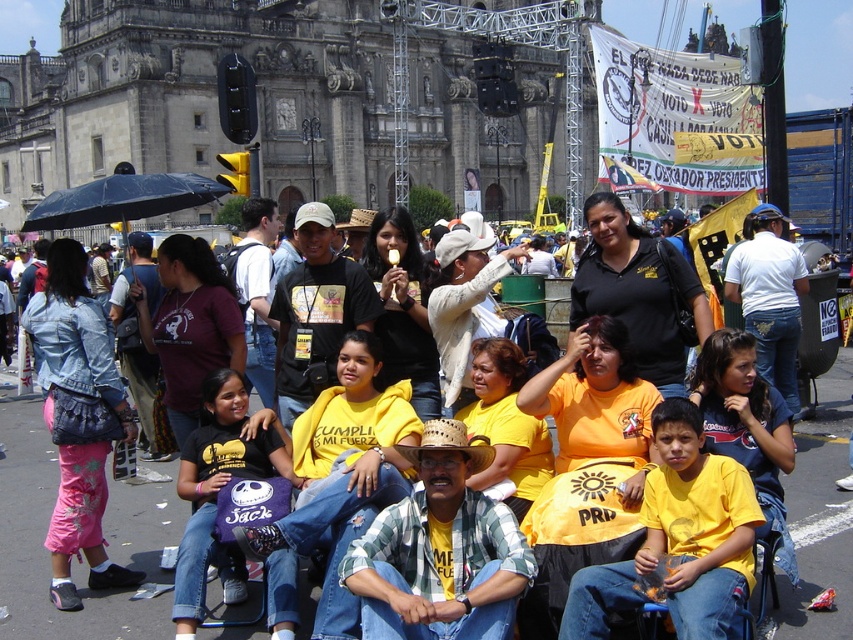
Is point (39, 502) behind point (45, 228)?

No, it is not.

What do you see at coordinates (41, 545) in the screenshot? I see `yellow/yellow shirt at center` at bounding box center [41, 545].

Describe the element at coordinates (41, 545) in the screenshot. I see `yellow/yellow shirt at center` at that location.

Locate an element on the screen. The image size is (853, 640). yellow/yellow shirt at center is located at coordinates (41, 545).